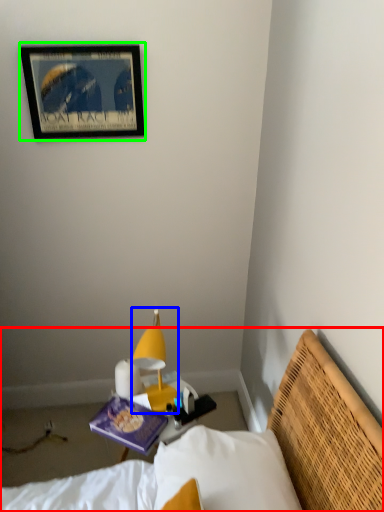
Question: Which object is the farthest from bed (highlighted by a red box)? Choose among these: lamp (highlighted by a blue box) or picture frame (highlighted by a green box).

Choices:
 (A) lamp
 (B) picture frame

Answer: (B)